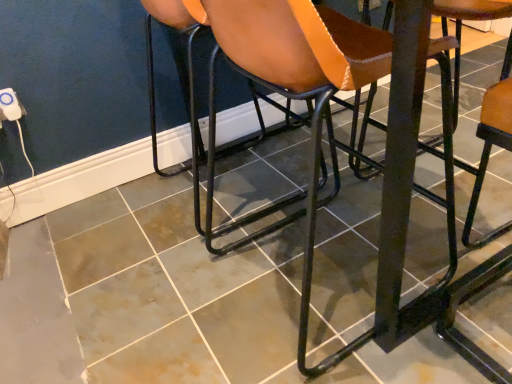
Question: Is brown leather chair at center, arranged as the second chair when viewed from the right, taller or shorter than brown leather chair at center, the 3th chair viewed from the right?

Choices:
 (A) short
 (B) tall

Answer: (B)

Question: Considering their positions, is brown leather chair at center, positioned as the second chair in left-to-right order, located in front of or behind brown leather chair at center, the 3th chair viewed from the right?

Choices:
 (A) behind
 (B) front

Answer: (B)

Question: Considering the real-world distances, which object is closest to the brown leather chair at center, positioned as the second chair in left-to-right order?

Choices:
 (A) metallic black stool at right, which is the third chair in left-to-right order
 (B) white plastic electric outlet at lower left
 (C) brown leather chair at center, the 3th chair viewed from the right

Answer: (C)

Question: Which is farther from the metallic black stool at right, which is the third chair in left-to-right order?

Choices:
 (A) brown leather chair at center, the 1th chair from the left
 (B) brown leather chair at center, positioned as the second chair in left-to-right order
 (C) white plastic electric outlet at lower left

Answer: (C)